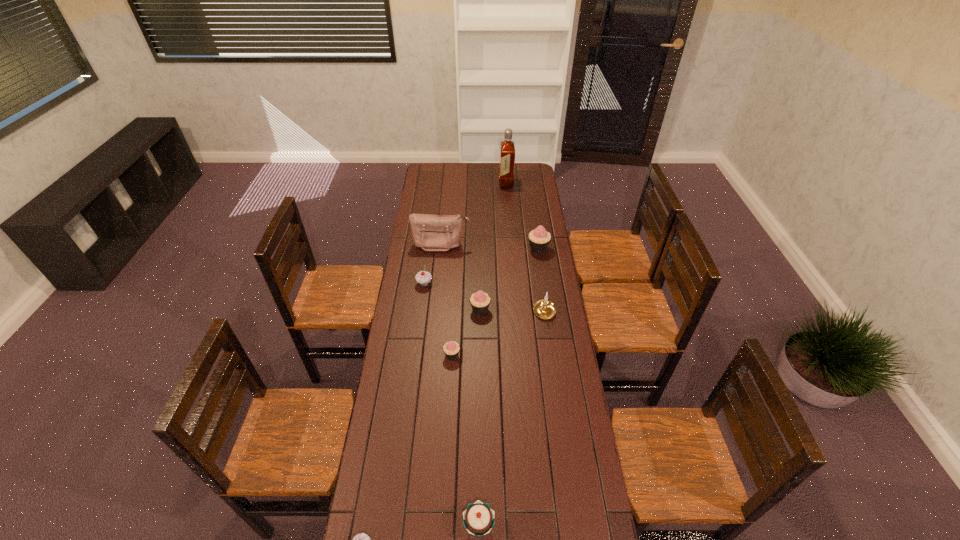
At what (x,y) coordinates should I click in order to perform the action: click on the third object from right to left. Please return your answer as a coordinate pair (x, y). Looking at the image, I should click on (507, 149).

Locate an element on the screen. liquor is located at coordinates (507, 149).

The height and width of the screenshot is (540, 960). I want to click on shoulder bag, so click(430, 232).

The width and height of the screenshot is (960, 540). Identify the location of the third tallest object. (539, 239).

This screenshot has height=540, width=960. In order to click on the biggest pink cupcake in this screenshot , I will do `click(539, 239)`.

This screenshot has width=960, height=540. Find the location of `candle holder`. candle holder is located at coordinates (544, 308).

Locate an element on the screen. The width and height of the screenshot is (960, 540). the fifth nearest cupcake is located at coordinates (423, 278).

This screenshot has height=540, width=960. Find the location of `the right gray cupcake`. the right gray cupcake is located at coordinates (423, 278).

Where is `the third farthest cupcake`? the third farthest cupcake is located at coordinates (480, 301).

The width and height of the screenshot is (960, 540). Identify the location of the second biggest pink cupcake. coord(480,301).